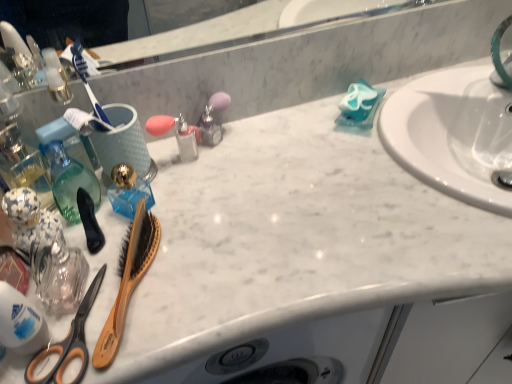
Identify the location of vacant space behind translucent plastic bottle at lower left, arranged as the 2th cleaning product when viewed from the back. (112, 239).